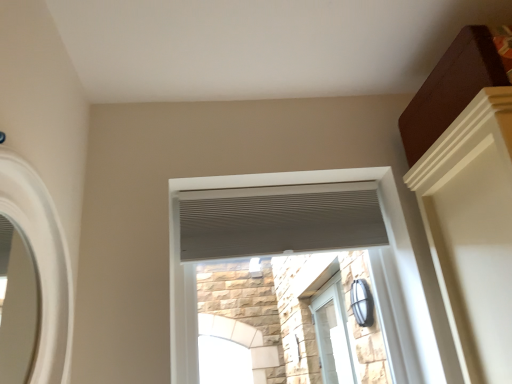
Question: Does white matte mirror at left, marked as the 3th window in a back-to-front arrangement, lie in front of white textured vent at center, arranged as the 2th window when viewed from the left?

Choices:
 (A) yes
 (B) no

Answer: (A)

Question: Can you confirm if white matte mirror at left, the third window viewed from the right, is taller than white textured vent at center, arranged as the 2th window when viewed from the left?

Choices:
 (A) no
 (B) yes

Answer: (A)

Question: Is the depth of white matte mirror at left, which is the 3th window from bottom to top, greater than that of white textured vent at center, arranged as the 2th window when viewed from the front?

Choices:
 (A) yes
 (B) no

Answer: (B)

Question: Considering the relative positions of white matte mirror at left, acting as the first window starting from the front, and white textured vent at center, which is the second window in bottom-to-top order, in the image provided, is white matte mirror at left, acting as the first window starting from the front, to the left of white textured vent at center, which is the second window in bottom-to-top order, from the viewer's perspective?

Choices:
 (A) yes
 (B) no

Answer: (A)

Question: Is white matte mirror at left, acting as the first window starting from the front, outside of white textured vent at center, which is the second window in bottom-to-top order?

Choices:
 (A) yes
 (B) no

Answer: (A)

Question: From a real-world perspective, is white matte mirror at left, which is the 1th window in left-to-right order, physically above white textured vent at center, arranged as the 2th window when viewed from the left?

Choices:
 (A) no
 (B) yes

Answer: (A)

Question: Does white textured vent at center, which is the second window in bottom-to-top order, have a lesser height compared to white matte mirror at left, the third window viewed from the right?

Choices:
 (A) yes
 (B) no

Answer: (B)

Question: Is white matte mirror at left, acting as the first window starting from the front, surrounded by white textured vent at center, marked as the 2th window in a top-to-bottom arrangement?

Choices:
 (A) no
 (B) yes

Answer: (A)

Question: Is white matte mirror at left, acting as the first window starting from the front, at the back of white textured vent at center, which appears as the second window when viewed from the back?

Choices:
 (A) no
 (B) yes

Answer: (A)

Question: From a real-world perspective, is white textured vent at center, arranged as the 2th window when viewed from the left, located higher than white matte mirror at left, the third window viewed from the right?

Choices:
 (A) yes
 (B) no

Answer: (A)

Question: From the image's perspective, is white textured vent at center, acting as the 2th window starting from the right, on white matte mirror at left, marked as the 3th window in a back-to-front arrangement?

Choices:
 (A) yes
 (B) no

Answer: (B)

Question: Is there a large distance between white textured vent at center, marked as the 2th window in a top-to-bottom arrangement, and white matte mirror at left, marked as the 3th window in a back-to-front arrangement?

Choices:
 (A) no
 (B) yes

Answer: (A)

Question: Does white textured blind at upper center appear on the right side of white textured vent at center, which appears as the second window when viewed from the back?

Choices:
 (A) yes
 (B) no

Answer: (B)